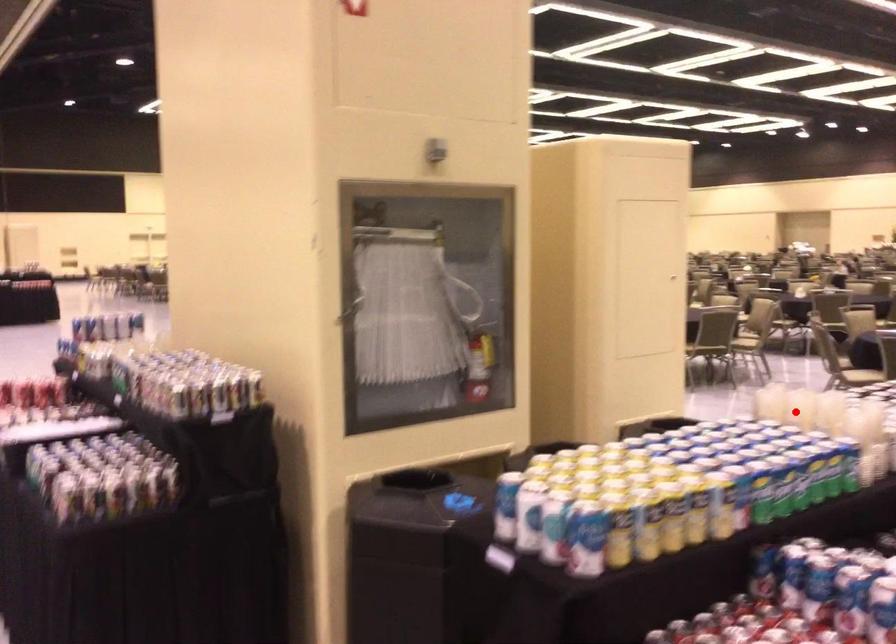
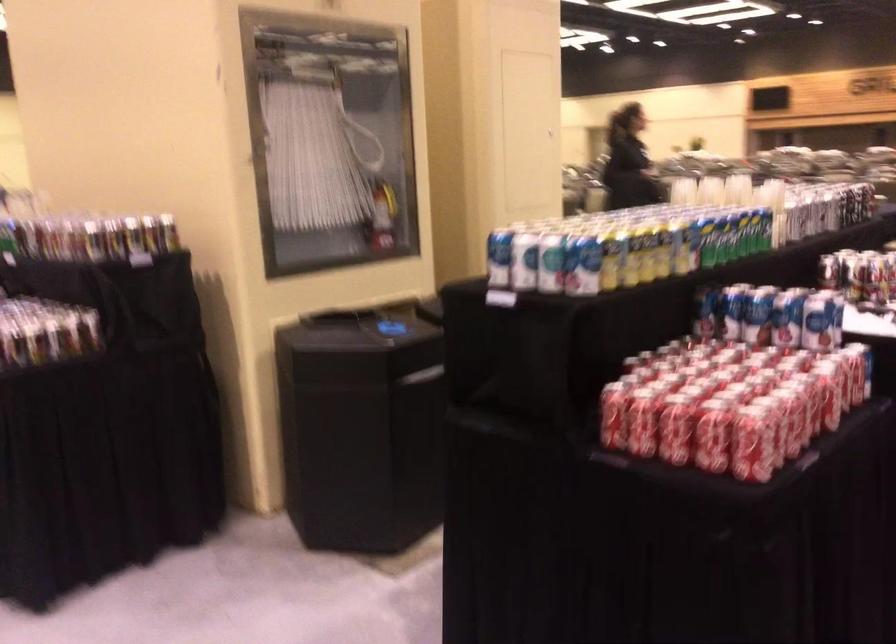
Find the pixel in the second image that matches the highlighted location in the first image.

(711, 190)